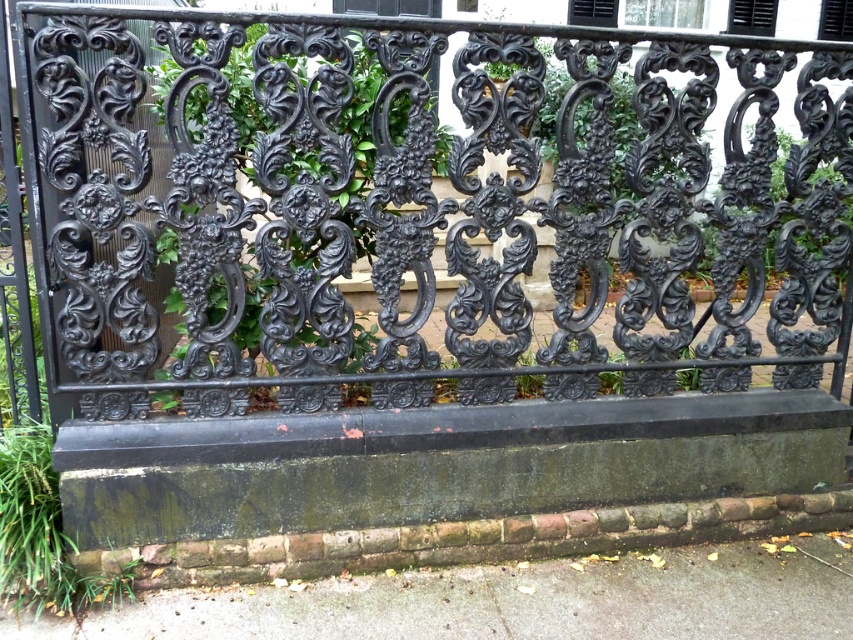
You are standing on the gray concrete pavement at lower center and want to walk towards the black wrought iron fence at center. In which direction should you move?

You should move to the right because the black wrought iron fence at center is to the left of gray concrete pavement at lower center, so moving right will bring you closer to it.

You are a delivery person trying to navigate a narrow path. You see the black wrought iron fence at center and the gray concrete pavement at lower center. Which one has a wider path for you to pass through?

Result: The black wrought iron fence at center has a larger width than the gray concrete pavement at lower center, so the path through the black wrought iron fence at center is wider.

You are standing at the base of the black wrought iron railing and want to walk towards the point marked at the coordinates. Which point would you reach first, the point at coordinates point (97, 36) or point (276, 596)?

You would reach the point at coordinates point (97, 36) first because it is in front of point (276, 596).